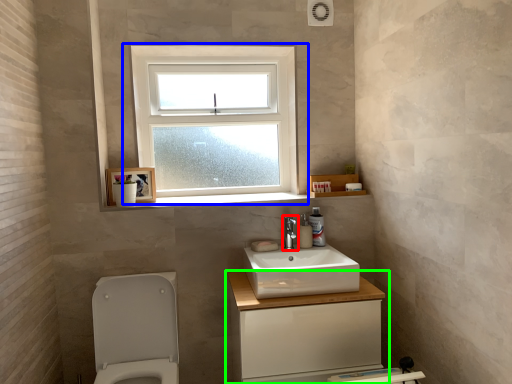
Question: Estimate the real-world distances between objects in this image. Which object is farther from tap (highlighted by a red box), window (highlighted by a blue box) or bathroom cabinet (highlighted by a green box)?

Choices:
 (A) window
 (B) bathroom cabinet

Answer: (A)